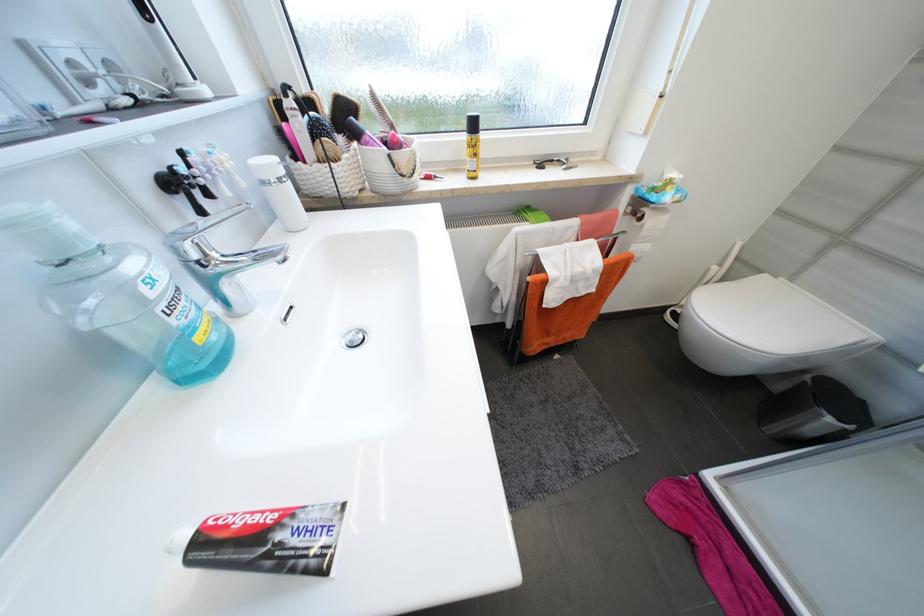
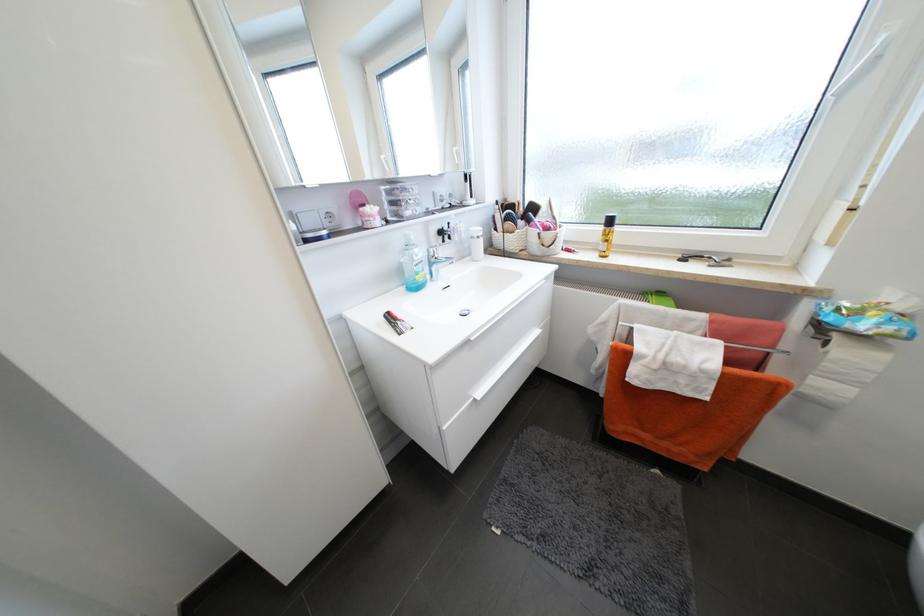
In the second image, find the point that corresponds to point 271,185 in the first image.

(478, 238)